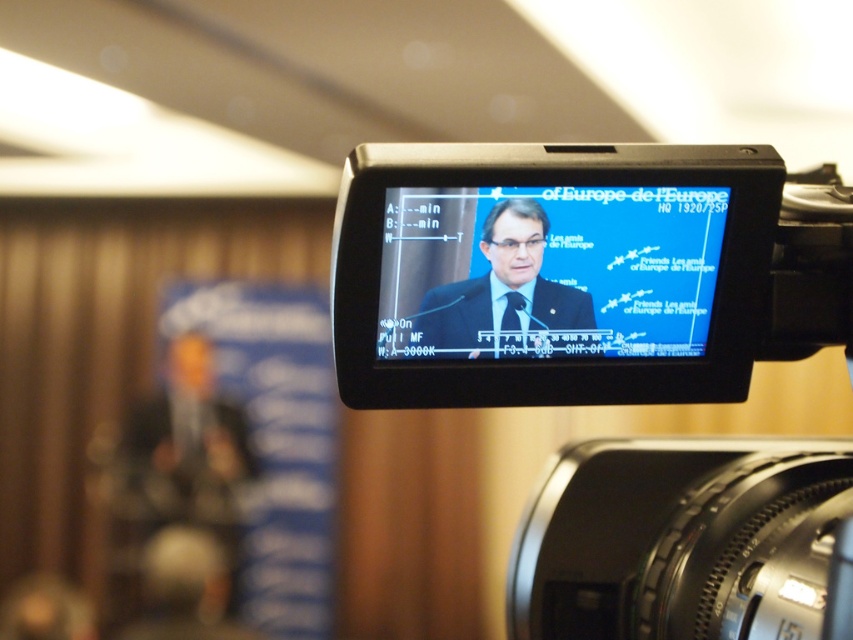
Is black plastic video camera at center thinner than matte black monitor at center?

Incorrect, black plastic video camera at center's width is not less than matte black monitor at center's.

Between black plastic video camera at center and matte black monitor at center, which one appears on the left side from the viewer's perspective?

From the viewer's perspective, matte black monitor at center appears more on the left side.

Does point (695, 518) come in front of point (502, 304)?

No.

Where is `black plastic video camera at center`? black plastic video camera at center is located at coordinates (579, 273).

Can you confirm if black plastic video camera at center is smaller than matte black screen at center?

Incorrect, black plastic video camera at center is not smaller in size than matte black screen at center.

Which is more to the left, black plastic video camera at center or matte black screen at center?

Positioned to the left is matte black screen at center.

Is point (738, 582) positioned in front of point (434, 355)?

Yes, it is.

Identify the location of black plastic video camera at center. (579, 273).

Can you confirm if matte black screen at center is shorter than matte black monitor at center?

Answer: In fact, matte black screen at center may be taller than matte black monitor at center.

Measure the distance between matte black screen at center and camera.

33.69 inches

Locate an element on the screen. matte black screen at center is located at coordinates (548, 272).